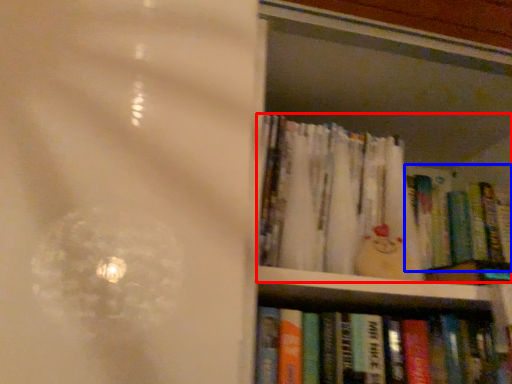
Question: Among these objects, which one is nearest to the camera, book (highlighted by a red box) or book (highlighted by a blue box)?

Choices:
 (A) book
 (B) book

Answer: (A)